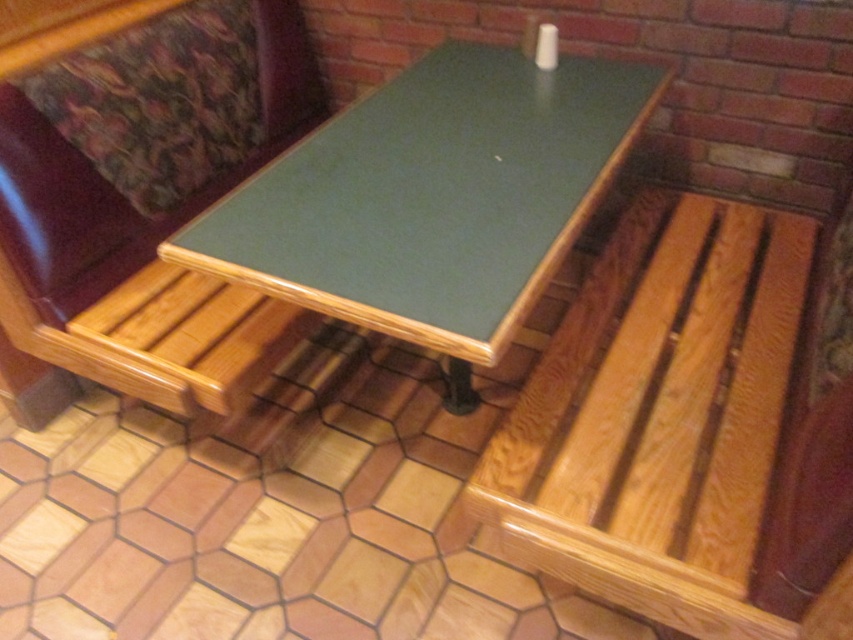
Question: Which object is farther from the camera taking this photo?

Choices:
 (A) green laminate table at center
 (B) wooden bench at center
 (C) light brown wood bench at lower right

Answer: (B)

Question: Estimate the real-world distances between objects in this image. Which object is closer to the wooden bench at center?

Choices:
 (A) light brown wood bench at lower right
 (B) green laminate table at center

Answer: (B)

Question: Which point is closer to the camera taking this photo?

Choices:
 (A) (474, 470)
 (B) (397, 225)

Answer: (B)

Question: Does light brown wood bench at lower right have a greater width compared to green laminate table at center?

Choices:
 (A) no
 (B) yes

Answer: (A)

Question: Can you confirm if light brown wood bench at lower right is thinner than green laminate table at center?

Choices:
 (A) yes
 (B) no

Answer: (A)

Question: Is green laminate table at center wider than wooden bench at center?

Choices:
 (A) no
 (B) yes

Answer: (B)